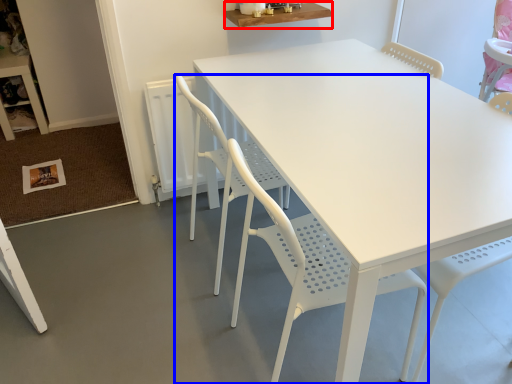
Question: Which object is closer to the camera taking this photo, table (highlighted by a red box) or chair (highlighted by a blue box)?

Choices:
 (A) table
 (B) chair

Answer: (B)